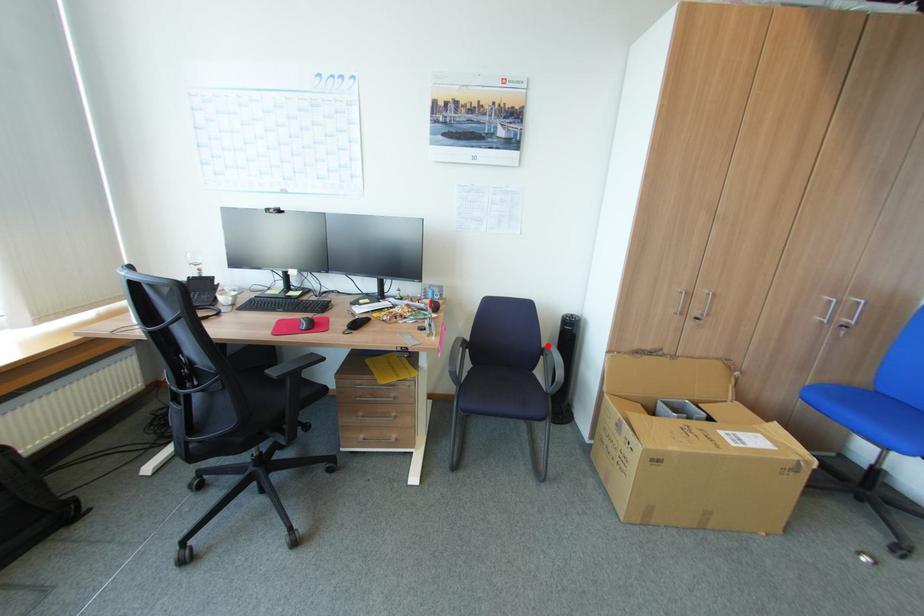
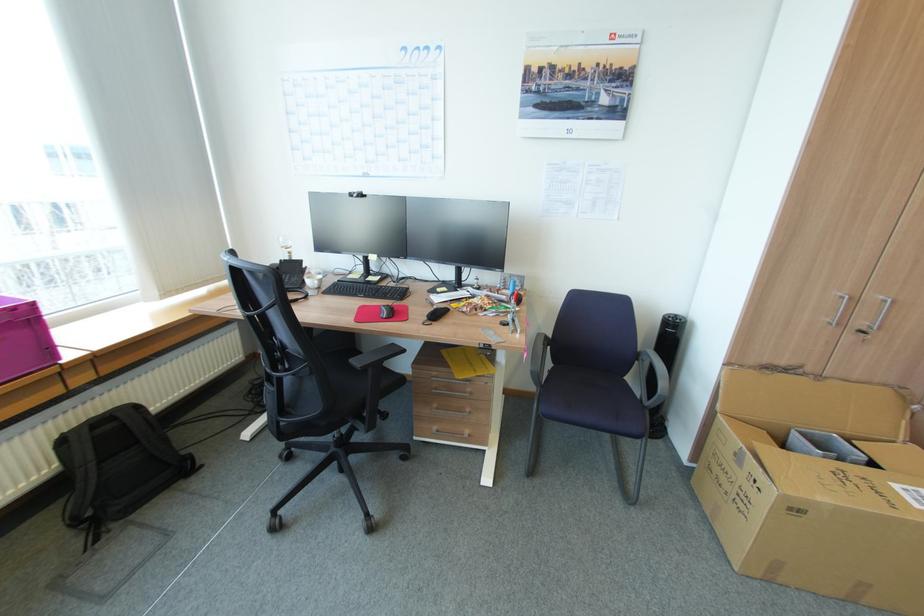
Where in the second image is the point corresponding to the highlighted location from the first image?

(643, 350)